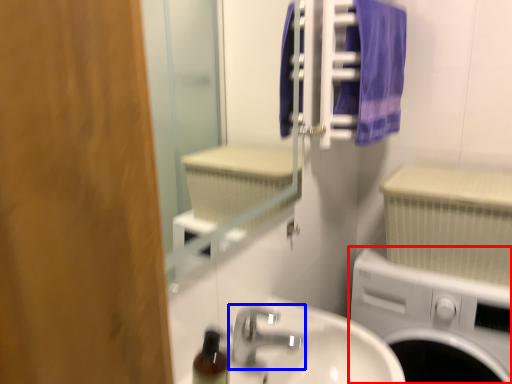
Question: Which object appears farthest to the camera in this image, washing machine (highlighted by a red box) or tap (highlighted by a blue box)?

Choices:
 (A) washing machine
 (B) tap

Answer: (A)